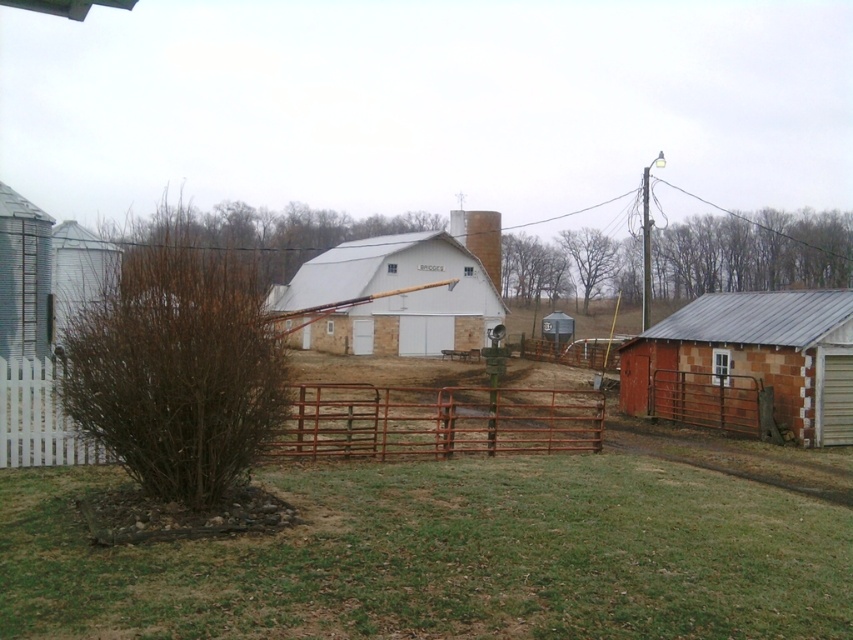
You are standing at the center of the image, which is the white barn with a metal roof. There is a point marked at coordinate [747,364]. What object is located at that point?

The point at coordinate [747,364] indicates the rustic brick shed at right.

You are a farmer who needs to move a heavy load from the rustic brick shed at right to the brushed metal silo at left. The tractor you have can only tow items up to 16 meters. Can you safely tow the load between these two structures without exceeding the tractor towing distance limit?

The rustic brick shed at right and the brushed metal silo at left are 15.90 meters apart. Since the tractor can tow up to 16 meters, you can safely tow the load between them as the distance is within the tractor towing limit.

You are a farmer who needs to move a heavy load from the rustic brick shed at right to the brushed metal silo at left. Considering their positions, which direction should you move the load to reach the destination?

The rustic brick shed at right is below the brushed metal silo at left, so you should move the load upward to reach the destination.